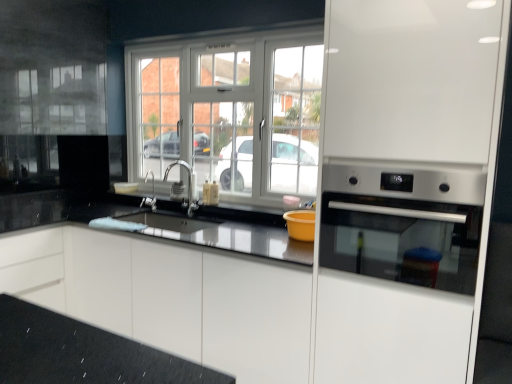
Question: Is satin nickel faucet at center bigger than satin nickel faucet at center?

Choices:
 (A) yes
 (B) no

Answer: (A)

Question: From the image's perspective, is satin nickel faucet at center beneath satin nickel faucet at center?

Choices:
 (A) yes
 (B) no

Answer: (A)

Question: From the image's perspective, is satin nickel faucet at center on top of satin nickel faucet at center?

Choices:
 (A) no
 (B) yes

Answer: (A)

Question: Is satin nickel faucet at center thinner than satin nickel faucet at center?

Choices:
 (A) yes
 (B) no

Answer: (B)

Question: Is satin nickel faucet at center surrounding satin nickel faucet at center?

Choices:
 (A) yes
 (B) no

Answer: (B)

Question: Do you think white plastic window at center is within white glossy cabinet at center, or outside of it?

Choices:
 (A) inside
 (B) outside

Answer: (B)

Question: Visually, is white plastic window at center positioned to the left or to the right of white glossy cabinet at center?

Choices:
 (A) right
 (B) left

Answer: (A)

Question: In terms of width, does white plastic window at center look wider or thinner when compared to white glossy cabinet at center?

Choices:
 (A) thin
 (B) wide

Answer: (A)

Question: Considering the positions of white plastic window at center and white glossy cabinet at center in the image, is white plastic window at center taller or shorter than white glossy cabinet at center?

Choices:
 (A) tall
 (B) short

Answer: (A)

Question: In terms of size, does satin silver oven at right appear bigger or smaller than white plastic window at center?

Choices:
 (A) big
 (B) small

Answer: (B)

Question: Relative to white plastic window at center, is satin silver oven at right in front or behind?

Choices:
 (A) front
 (B) behind

Answer: (A)

Question: Is satin silver oven at right to the left or to the right of white plastic window at center in the image?

Choices:
 (A) right
 (B) left

Answer: (A)

Question: Is point 400,271 closer or farther from the camera than point 138,97?

Choices:
 (A) closer
 (B) farther

Answer: (A)

Question: Is point (155, 208) positioned closer to the camera than point (351, 238)?

Choices:
 (A) farther
 (B) closer

Answer: (A)

Question: From their relative heights in the image, would you say satin nickel faucet at center is taller or shorter than satin silver oven at right?

Choices:
 (A) tall
 (B) short

Answer: (B)